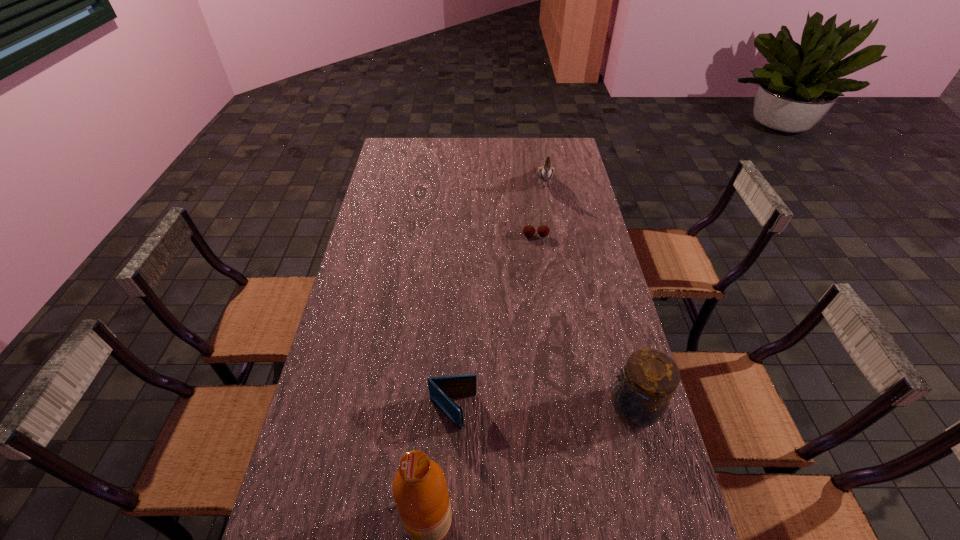
In the image, there is a desktop. Identify the location of vacant space at the right edge. (570, 231).

Locate an element on the screen. Image resolution: width=960 pixels, height=540 pixels. vacant position at the far right corner of the desktop is located at coordinates (561, 152).

Locate an element on the screen. This screenshot has width=960, height=540. vacant area between the second farthest object and the farthest object is located at coordinates (540, 209).

Locate an element on the screen. This screenshot has width=960, height=540. empty space between the rightmost object and the bird is located at coordinates (588, 294).

This screenshot has width=960, height=540. In order to click on empty space between the cherry and the shortest object in this screenshot , I will do `click(494, 324)`.

Locate an element on the screen. vacant region between the wallet and the bird is located at coordinates (498, 296).

Locate an element on the screen. Image resolution: width=960 pixels, height=540 pixels. empty space that is in between the cherry and the farthest object is located at coordinates (540, 209).

At what (x,y) coordinates should I click in order to perform the action: click on free space between the cherry and the farthest object. Please return your answer as a coordinate pair (x, y). Looking at the image, I should click on pyautogui.click(x=540, y=209).

Find the location of `free spot between the bird and the wallet`. free spot between the bird and the wallet is located at coordinates (498, 296).

Identify which object is the fourth closest to the shortest object. Please provide its 2D coordinates. Your answer should be formatted as a tuple, i.e. [(x, y)], where the tuple contains the x and y coordinates of a point satisfying the conditions above.

[(545, 173)]